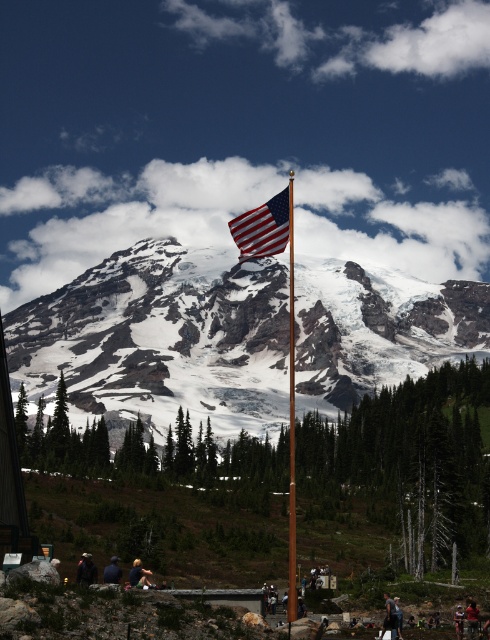
This screenshot has height=640, width=490. Find the location of `dark blue jeans at lower right`. dark blue jeans at lower right is located at coordinates (391, 616).

Where is `dark blue jeans at lower right`? dark blue jeans at lower right is located at coordinates (391, 616).

Who is positioned more to the right, american flag at center or red shirt at center?

From the viewer's perspective, red shirt at center appears more on the right side.

Which is below, american flag at center or red shirt at center?

Positioned lower is red shirt at center.

Between point (243, 234) and point (469, 634), which one is positioned behind?

The point (243, 234) is more distant.

Find the location of a particular element. This screenshot has height=640, width=490. american flag at center is located at coordinates (264, 227).

What are the coordinates of `polished wood flag pole at center` in the screenshot? It's located at (292, 422).

Does polished wood flag pole at center lie in front of dark blue fabric at lower center?

Yes, it is.

Is point (290, 465) farther from camera compared to point (117, 577)?

That is True.

The height and width of the screenshot is (640, 490). I want to click on polished wood flag pole at center, so click(292, 422).